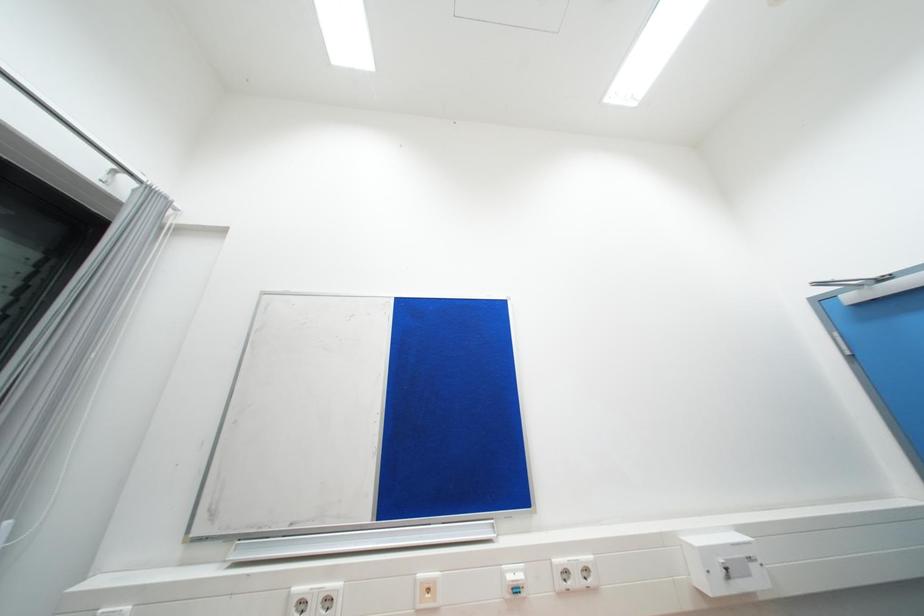
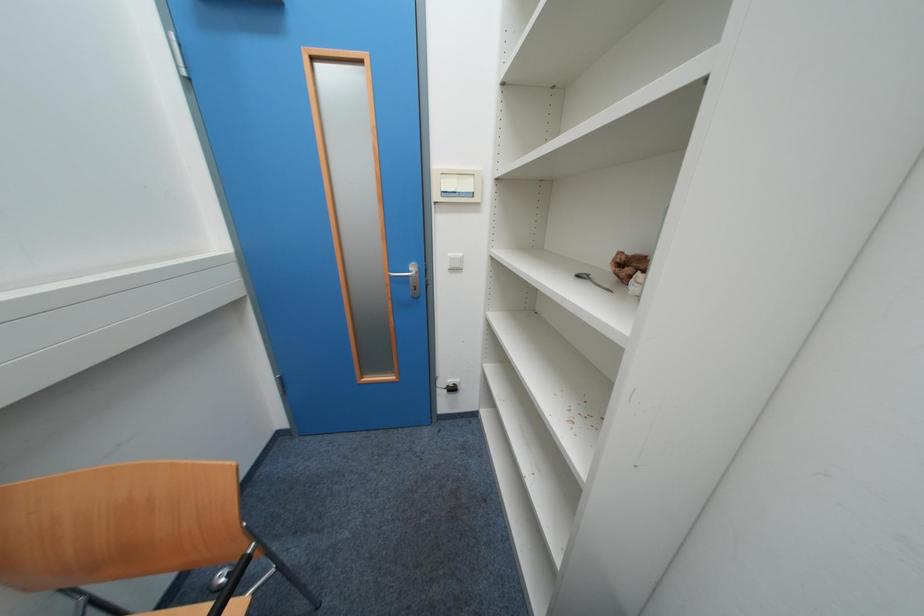
First-person continuous shooting, in which direction is the camera rotating?

The rotation direction of the camera is right-down.